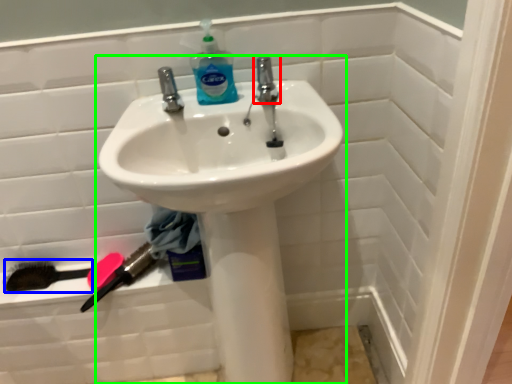
Question: Which is farther away from tap (highlighted by a red box)? brush (highlighted by a blue box) or sink (highlighted by a green box)?

Choices:
 (A) brush
 (B) sink

Answer: (A)